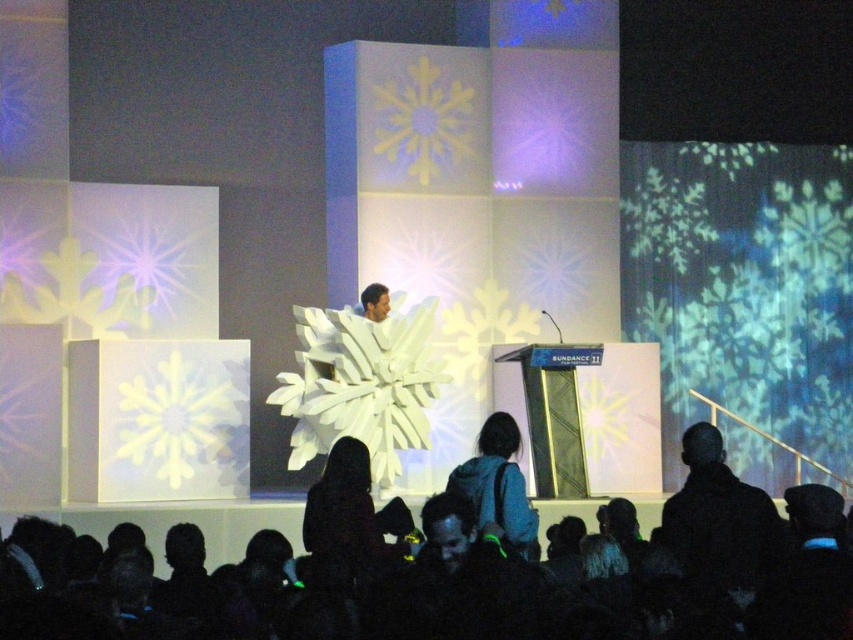
Who is lower down, black fabric at lower center or dark brown leather jacket at center?

dark brown leather jacket at center

Does black fabric at lower center have a smaller size compared to dark brown leather jacket at center?

No, black fabric at lower center is not smaller than dark brown leather jacket at center.

Image resolution: width=853 pixels, height=640 pixels. In order to click on black fabric at lower center in this screenshot , I will do `click(448, 573)`.

Identify the location of black fabric at lower center. Image resolution: width=853 pixels, height=640 pixels. (448, 573).

Who is more distant from viewer, [62,609] or [502,504]?

Positioned behind is point [502,504].

Where is `black fabric at lower center`? The height and width of the screenshot is (640, 853). black fabric at lower center is located at coordinates (448, 573).

Which is behind, point (711, 545) or point (488, 492)?

The point (488, 492) is more distant.

Locate an element on the screen. black fabric at lower center is located at coordinates (448, 573).

Can you confirm if black matte jacket at lower right is positioned below blue backpack at center?

Yes.

Does black matte jacket at lower right appear over blue backpack at center?

Actually, black matte jacket at lower right is below blue backpack at center.

At what (x,y) coordinates should I click in order to perform the action: click on black matte jacket at lower right. Please return your answer as a coordinate pair (x, y). Looking at the image, I should click on (718, 525).

The width and height of the screenshot is (853, 640). Identify the location of black matte jacket at lower right. pos(718,525).